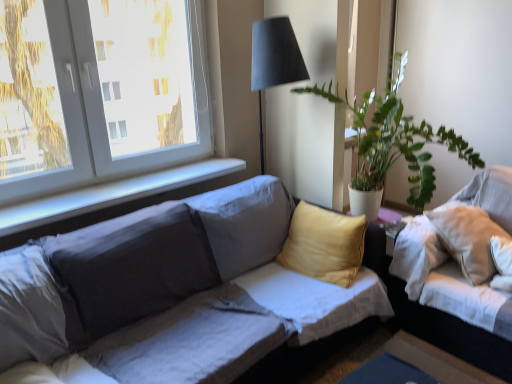
Describe the element at coordinates (449, 302) in the screenshot. The image size is (512, 384). I see `white fabric couch at right, the 1th studio couch positioned from the right` at that location.

What is the approximate height of white plastic window at upper left?

37.75 inches.

At what (x,y) coordinates should I click in order to perform the action: click on white fabric couch at right, the 1th studio couch positioned from the right. Please return your answer as a coordinate pair (x, y). Looking at the image, I should click on (449, 302).

Who is smaller, matte gray couch at center, the first studio couch viewed from the left, or white fabric couch at right, the 1th studio couch positioned from the right?

Result: With smaller size is white fabric couch at right, the 1th studio couch positioned from the right.

Which object is wider, matte gray couch at center, the first studio couch viewed from the left, or white fabric couch at right, marked as the 2th studio couch in a left-to-right arrangement?

matte gray couch at center, the first studio couch viewed from the left, is wider.

Visually, is matte gray couch at center, the first studio couch viewed from the left, positioned to the left or to the right of white fabric couch at right, marked as the 2th studio couch in a left-to-right arrangement?

From the image, it's evident that matte gray couch at center, the first studio couch viewed from the left, is to the left of white fabric couch at right, marked as the 2th studio couch in a left-to-right arrangement.

Can you tell me how much matte gray couch at center, the first studio couch viewed from the left, and white fabric couch at right, marked as the 2th studio couch in a left-to-right arrangement, differ in facing direction?

They differ by 89.3 degrees in their facing directions.

In terms of width, does white smooth window sill at upper left look wider or thinner when compared to matte gray couch at center, the first studio couch viewed from the left?

white smooth window sill at upper left is thinner than matte gray couch at center, the first studio couch viewed from the left.

Does white smooth window sill at upper left appear on the left side of matte gray couch at center, the second studio couch positioned from the right?

Indeed, white smooth window sill at upper left is positioned on the left side of matte gray couch at center, the second studio couch positioned from the right.

Can you tell me how much white smooth window sill at upper left and matte gray couch at center, the second studio couch positioned from the right, differ in facing direction?

1.32 degrees separate the facing orientations of white smooth window sill at upper left and matte gray couch at center, the second studio couch positioned from the right.

Can you confirm if white smooth window sill at upper left is taller than matte gray couch at center, the second studio couch positioned from the right?

No.

Based on the photo, which of these two, white plastic window at upper left or green leafy plant at upper right, is bigger?

Bigger between the two is green leafy plant at upper right.

From the image's perspective, which is above, white plastic window at upper left or green leafy plant at upper right?

white plastic window at upper left appears higher in the image.

The image size is (512, 384). I want to click on houseplant that appears on the right of white plastic window at upper left, so click(395, 140).

Is white plastic window at upper left far from green leafy plant at upper right?

Yes, white plastic window at upper left and green leafy plant at upper right are located far from each other.

Is matte gray couch at center, the second studio couch positioned from the right, taller than white plastic window at upper left?

No, matte gray couch at center, the second studio couch positioned from the right, is not taller than white plastic window at upper left.

Are matte gray couch at center, the first studio couch viewed from the left, and white plastic window at upper left far apart?

No, there isn't a large distance between matte gray couch at center, the first studio couch viewed from the left, and white plastic window at upper left.

From a real-world perspective, between matte gray couch at center, the second studio couch positioned from the right, and white plastic window at upper left, who is vertically higher?

white plastic window at upper left, from a real-world perspective.

Considering the sizes of objects green leafy plant at upper right and white fabric couch at right, the 1th studio couch positioned from the right, in the image provided, who is thinner, green leafy plant at upper right or white fabric couch at right, the 1th studio couch positioned from the right,?

green leafy plant at upper right is thinner.

From a real-world perspective, is green leafy plant at upper right below white fabric couch at right, marked as the 2th studio couch in a left-to-right arrangement?

No.

From the image's perspective, which object appears higher, green leafy plant at upper right or white fabric couch at right, marked as the 2th studio couch in a left-to-right arrangement?

green leafy plant at upper right.

Is point (466, 150) more distant than point (412, 242)?

Yes, it is behind point (412, 242).

Is green leafy plant at upper right outside of matte gray couch at center, the second studio couch positioned from the right?

Yes, green leafy plant at upper right is not within matte gray couch at center, the second studio couch positioned from the right.

Can you confirm if green leafy plant at upper right is positioned to the right of matte gray couch at center, the second studio couch positioned from the right?

Yes, green leafy plant at upper right is to the right of matte gray couch at center, the second studio couch positioned from the right.

Considering the relative sizes of green leafy plant at upper right and matte gray couch at center, the first studio couch viewed from the left, in the image provided, is green leafy plant at upper right wider than matte gray couch at center, the first studio couch viewed from the left,?

No.

From the image's perspective, relative to green leafy plant at upper right, is white fabric couch at right, the 1th studio couch positioned from the right, above or below?

Clearly, from the image's perspective, white fabric couch at right, the 1th studio couch positioned from the right, is below green leafy plant at upper right.

From a real-world perspective, is white fabric couch at right, the 1th studio couch positioned from the right, located beneath green leafy plant at upper right?

Correct, in the physical world, white fabric couch at right, the 1th studio couch positioned from the right, is lower than green leafy plant at upper right.

Who is taller, white fabric couch at right, the 1th studio couch positioned from the right, or green leafy plant at upper right?

Standing taller between the two is green leafy plant at upper right.

In order to click on the 1st studio couch located beneath the green leafy plant at upper right (from a real-world perspective) in this screenshot , I will do `click(449, 302)`.

This screenshot has height=384, width=512. Identify the location of studio couch on the left of white fabric couch at right, the 1th studio couch positioned from the right. pos(169,294).

Where is `window sill that is behind the matte gray couch at center, the second studio couch positioned from the right`? window sill that is behind the matte gray couch at center, the second studio couch positioned from the right is located at coordinates click(x=111, y=194).

Looking at the image, which one is located closer to white plastic window at upper left, white smooth window sill at upper left or green leafy plant at upper right?

Based on the image, white smooth window sill at upper left appears to be nearer to white plastic window at upper left.

Looking at this image, from the image, which object appears to be farther from matte gray couch at center, the second studio couch positioned from the right, white smooth window sill at upper left or white plastic window at upper left?

Based on the image, white plastic window at upper left appears to be further to matte gray couch at center, the second studio couch positioned from the right.

From the image, which object appears to be nearer to matte gray couch at center, the first studio couch viewed from the left, white fabric couch at right, marked as the 2th studio couch in a left-to-right arrangement, or white smooth window sill at upper left?

white smooth window sill at upper left.

Based on the photo, based on their spatial positions, is white fabric couch at right, marked as the 2th studio couch in a left-to-right arrangement, or green leafy plant at upper right further from matte gray couch at center, the second studio couch positioned from the right?

green leafy plant at upper right is further to matte gray couch at center, the second studio couch positioned from the right.

When comparing their distances from matte gray couch at center, the second studio couch positioned from the right, does white plastic window at upper left or white fabric couch at right, marked as the 2th studio couch in a left-to-right arrangement, seem further?

Based on the image, white plastic window at upper left appears to be further to matte gray couch at center, the second studio couch positioned from the right.

Estimate the real-world distances between objects in this image. Which object is further from white fabric couch at right, marked as the 2th studio couch in a left-to-right arrangement, matte gray couch at center, the first studio couch viewed from the left, or white plastic window at upper left?

Based on the image, white plastic window at upper left appears to be further to white fabric couch at right, marked as the 2th studio couch in a left-to-right arrangement.

When comparing their distances from white plastic window at upper left, does white fabric couch at right, marked as the 2th studio couch in a left-to-right arrangement, or green leafy plant at upper right seem further?

white fabric couch at right, marked as the 2th studio couch in a left-to-right arrangement, lies further to white plastic window at upper left than the other object.

Considering their positions, is green leafy plant at upper right positioned closer to white smooth window sill at upper left than white fabric couch at right, the 1th studio couch positioned from the right?

green leafy plant at upper right is closer to white smooth window sill at upper left.

Where is `studio couch between white plastic window at upper left and white fabric couch at right, marked as the 2th studio couch in a left-to-right arrangement, from left to right`? The height and width of the screenshot is (384, 512). studio couch between white plastic window at upper left and white fabric couch at right, marked as the 2th studio couch in a left-to-right arrangement, from left to right is located at coordinates (169, 294).

I want to click on window sill between white plastic window at upper left and matte gray couch at center, the first studio couch viewed from the left, in the up-down direction, so click(x=111, y=194).

Find the location of `houseplant situated between white smooth window sill at upper left and white fabric couch at right, the 1th studio couch positioned from the right, from left to right`. houseplant situated between white smooth window sill at upper left and white fabric couch at right, the 1th studio couch positioned from the right, from left to right is located at coordinates (395, 140).

At what (x,y) coordinates should I click in order to perform the action: click on houseplant situated between matte gray couch at center, the first studio couch viewed from the left, and white fabric couch at right, the 1th studio couch positioned from the right, from left to right. Please return your answer as a coordinate pair (x, y). The height and width of the screenshot is (384, 512). Looking at the image, I should click on (395, 140).